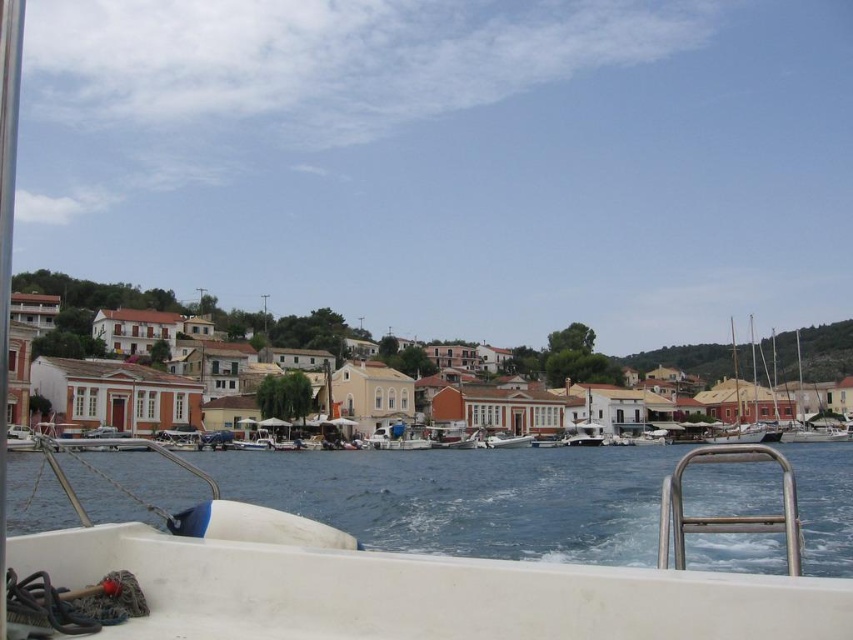
You are standing on the white matte boat at center and want to observe the blue water at lower center. Based on their heights, which one is taller?

The blue water at lower center is taller than the white matte boat at center according to the description.

You are a photographer trying to capture the white matte building at center and the white matte boat at center in a single shot. Based on their heights, which one will appear larger in the photo?

The white matte building at center is much taller than the white matte boat at center, so it will appear larger in the photo.